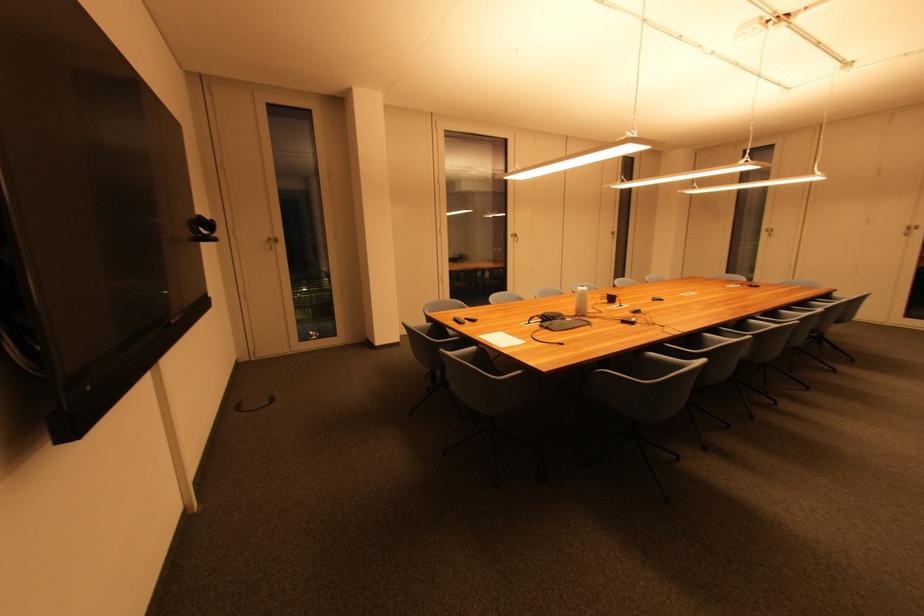
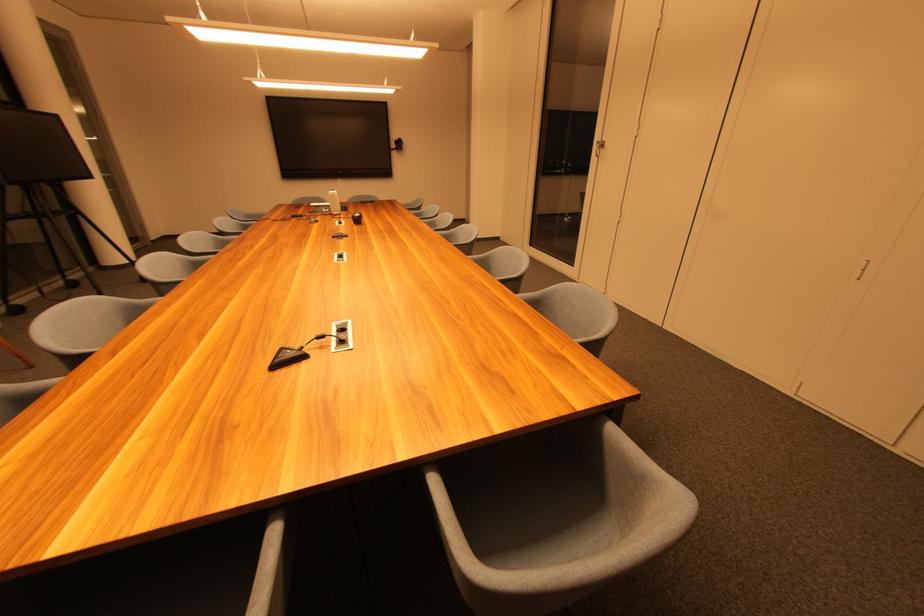
Find the pixel in the second image that matches [516,233] in the first image.

(602, 140)